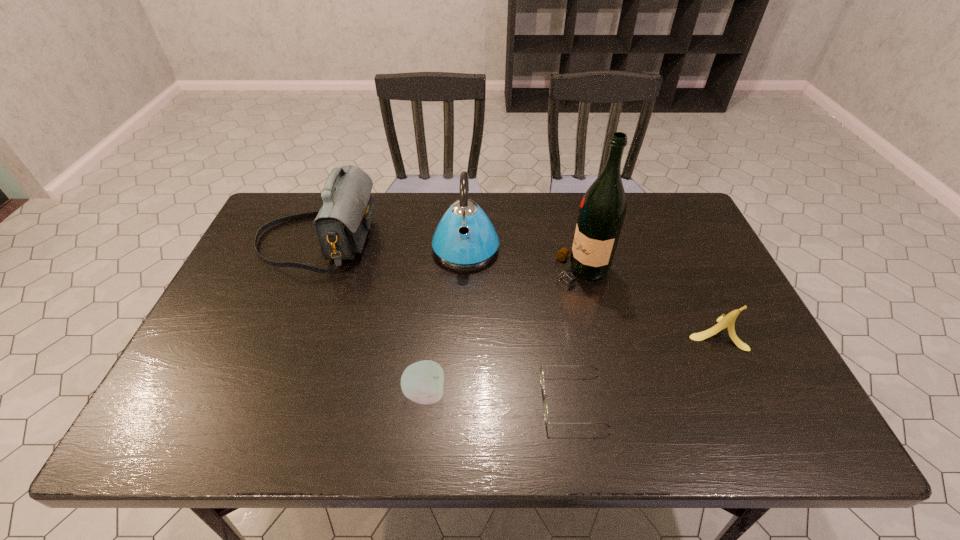
In order to click on wine bottle in this screenshot , I will do `click(602, 211)`.

At what (x,y) coordinates should I click in order to perform the action: click on kettle. Please return your answer as a coordinate pair (x, y). The height and width of the screenshot is (540, 960). Looking at the image, I should click on (465, 237).

At what (x,y) coordinates should I click in order to perform the action: click on the leftmost object. Please return your answer as a coordinate pair (x, y). The width and height of the screenshot is (960, 540). Looking at the image, I should click on (342, 223).

In order to click on banana in this screenshot , I will do `click(728, 321)`.

This screenshot has width=960, height=540. In order to click on the rightmost object in this screenshot , I will do `click(728, 321)`.

This screenshot has height=540, width=960. Find the location of `apple`. apple is located at coordinates (422, 382).

Find the location of `the shortest object`. the shortest object is located at coordinates (541, 369).

What are the coordinates of `vacant space located on the surface of the tallest object` in the screenshot? It's located at (459, 271).

I want to click on vacant space located 0.180m on the surface of the tallest object, so click(x=491, y=271).

Identify the location of free point located 0.220m on the surface of the tallest object. The width and height of the screenshot is (960, 540). [476, 271].